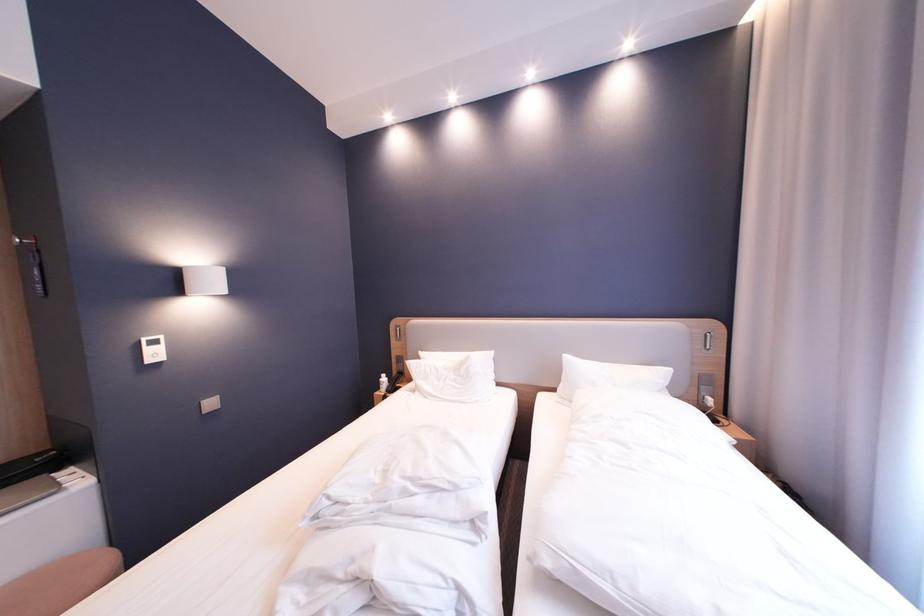
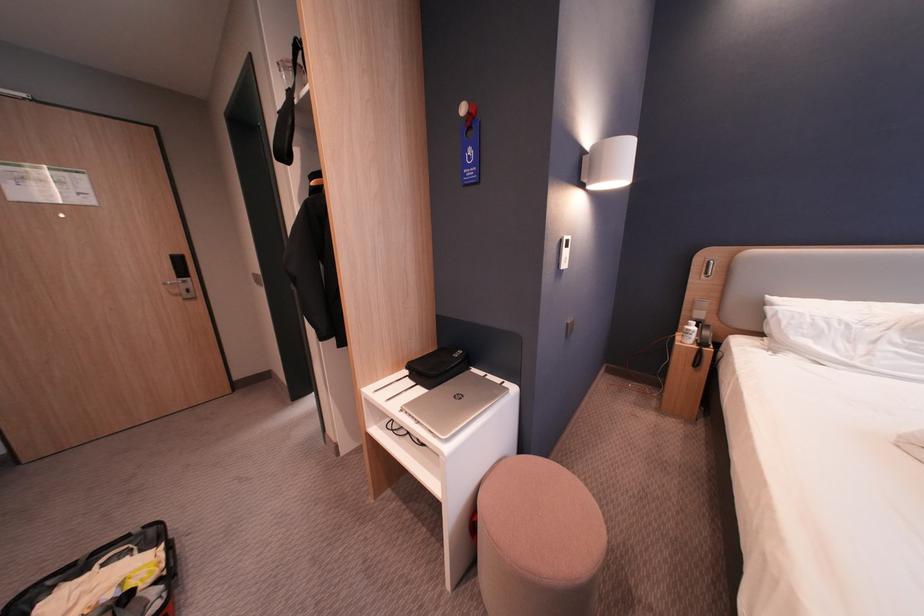
Locate, in the second image, the point that corresponds to (x=51, y=460) in the first image.

(467, 357)